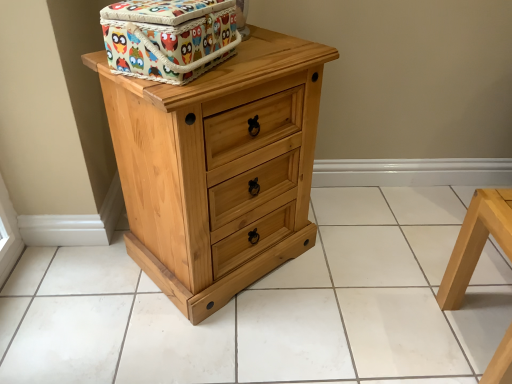
Question: Is natural wood chest of drawers at center at the right side of light wood stool at lower right?

Choices:
 (A) no
 (B) yes

Answer: (A)

Question: Is natural wood chest of drawers at center wider than light wood stool at lower right?

Choices:
 (A) yes
 (B) no

Answer: (A)

Question: Can you see natural wood chest of drawers at center touching light wood stool at lower right?

Choices:
 (A) yes
 (B) no

Answer: (B)

Question: Does natural wood chest of drawers at center turn towards light wood stool at lower right?

Choices:
 (A) no
 (B) yes

Answer: (B)

Question: From a real-world perspective, is natural wood chest of drawers at center physically above light wood stool at lower right?

Choices:
 (A) no
 (B) yes

Answer: (B)

Question: Is point (131, 158) positioned closer to the camera than point (166, 49)?

Choices:
 (A) closer
 (B) farther

Answer: (B)

Question: Is natural wood chest of drawers at center bigger or smaller than multicolored fabric box at upper center?

Choices:
 (A) big
 (B) small

Answer: (A)

Question: From a real-world perspective, is natural wood chest of drawers at center above or below multicolored fabric box at upper center?

Choices:
 (A) above
 (B) below

Answer: (B)

Question: Relative to multicolored fabric box at upper center, is natural wood chest of drawers at center in front or behind?

Choices:
 (A) front
 (B) behind

Answer: (B)

Question: From a real-world perspective, relative to natural wood tile at center, is natural wood chest of drawers at center vertically above or below?

Choices:
 (A) above
 (B) below

Answer: (A)

Question: Based on their positions, is natural wood chest of drawers at center located to the left or right of natural wood tile at center?

Choices:
 (A) right
 (B) left

Answer: (B)

Question: Looking at the image, does natural wood chest of drawers at center seem bigger or smaller compared to natural wood tile at center?

Choices:
 (A) small
 (B) big

Answer: (B)

Question: Considering the positions of natural wood chest of drawers at center and natural wood tile at center in the image, is natural wood chest of drawers at center taller or shorter than natural wood tile at center?

Choices:
 (A) tall
 (B) short

Answer: (A)

Question: Looking at their shapes, would you say natural wood tile at center is wider or thinner than multicolored fabric box at upper center?

Choices:
 (A) thin
 (B) wide

Answer: (B)

Question: Based on their sizes in the image, would you say natural wood tile at center is bigger or smaller than multicolored fabric box at upper center?

Choices:
 (A) big
 (B) small

Answer: (A)